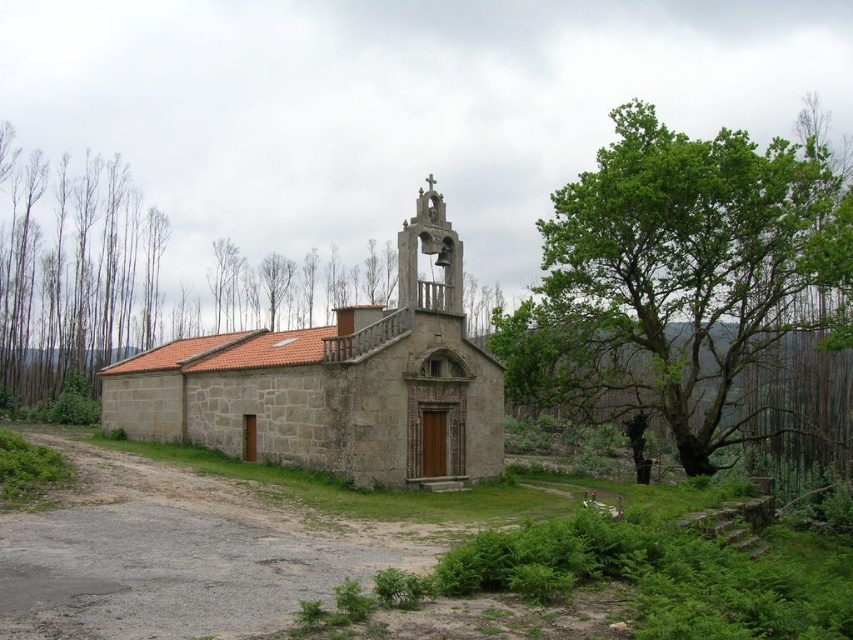
Can you confirm if green leafy tree at right is wider than bare wood trees at left?

Correct, the width of green leafy tree at right exceeds that of bare wood trees at left.

Describe the element at coordinates (669, 280) in the screenshot. I see `green leafy tree at right` at that location.

What are the coordinates of `green leafy tree at right` in the screenshot? It's located at (669, 280).

The width and height of the screenshot is (853, 640). What do you see at coordinates (669, 280) in the screenshot?
I see `green leafy tree at right` at bounding box center [669, 280].

How far apart are green leafy tree at right and stone church at center?

100.20 feet

Is point (728, 216) in front of point (387, 342)?

That is False.

Where is `green leafy tree at right`? Image resolution: width=853 pixels, height=640 pixels. green leafy tree at right is located at coordinates (669, 280).

You are a GUI agent. You are given a task and a screenshot of the screen. Output one action in this format:
    pyautogui.click(x=<x>, y=<y>)
    Task: Click on the stone church at center
    
    Given the screenshot: What is the action you would take?
    pyautogui.click(x=335, y=384)

Which is in front, point (113, 424) or point (28, 403)?

Point (113, 424) is more forward.

Find the location of a particular element. The width and height of the screenshot is (853, 640). stone church at center is located at coordinates (335, 384).